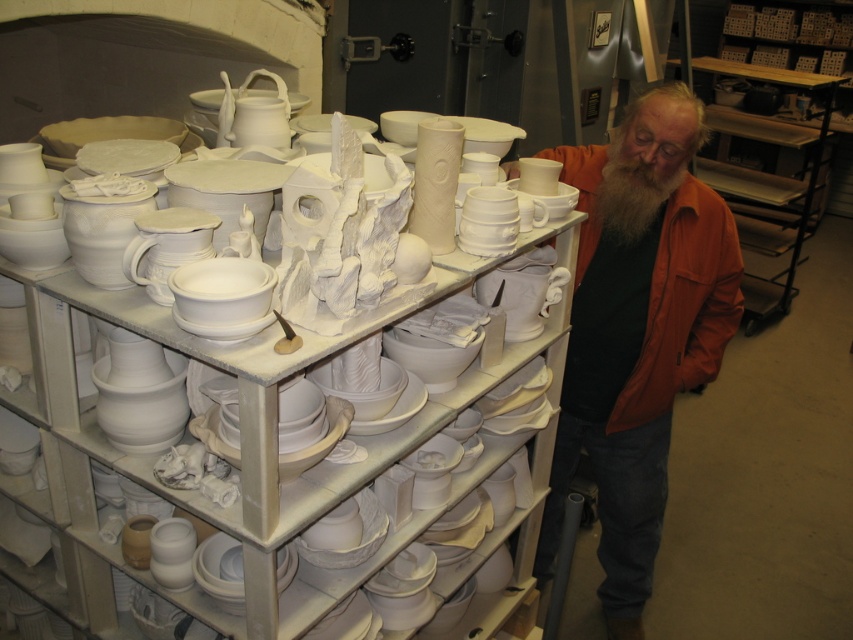
From the picture: You are a delivery person holding a box that is 4 feet long. You need to place the box in the pottery studio without it touching any of the white matte ceramics at center. Is there enough space between you and the ceramics to safely place the box?

The distance between the white matte ceramics at center and the camera is 3.86 feet. Since the box is 4 feet long, placing it would require more space than available. The box cannot be safely placed without touching the ceramics.

You are a delivery person who needs to place a large package between the white matte ceramics at center and the white matte beard at center. The package is 26 inches long. Can you fit it between them without moving either object?

The distance between the white matte ceramics at center and the white matte beard at center is 25.97 inches. Since the package is 26 inches long, it is slightly longer than the available space. Therefore, you cannot fit the package between them without moving either object.

You are standing in a pottery studio and notice the orange leather jacket at right. If you want to reach it without moving your feet, is it within arm s reach?

The orange leather jacket at right is 6.38 feet from viewer, which is beyond typical arm reach. You would need to move closer to grab it.